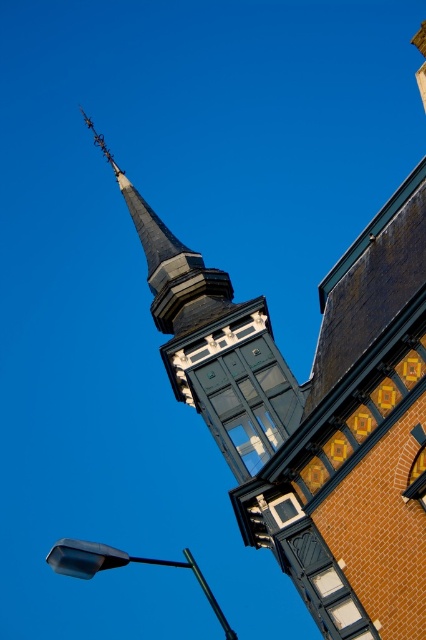
Question: Is dark gray slate steeple at upper left smaller than matte black streetlight at lower left?

Choices:
 (A) no
 (B) yes

Answer: (B)

Question: Which object is farther from the camera taking this photo?

Choices:
 (A) matte black streetlight at lower left
 (B) dark gray slate steeple at upper left

Answer: (B)

Question: Which point is closer to the camera?

Choices:
 (A) dark gray slate steeple at upper left
 (B) matte black streetlight at lower left

Answer: (B)

Question: Is dark gray slate steeple at upper left positioned before matte black streetlight at lower left?

Choices:
 (A) no
 (B) yes

Answer: (A)

Question: From the image, what is the correct spatial relationship of dark gray slate steeple at upper left in relation to matte black streetlight at lower left?

Choices:
 (A) above
 (B) below

Answer: (A)